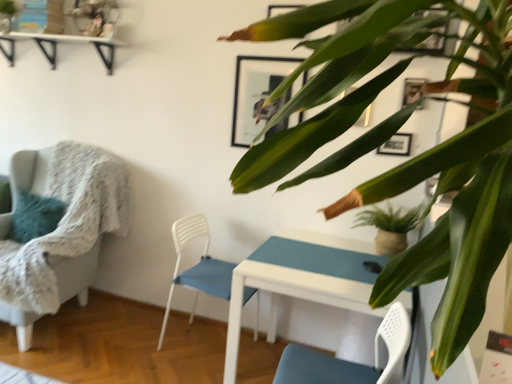
This screenshot has width=512, height=384. I want to click on blank area to the left of white plastic chair at center, marked as the second chair in a left-to-right arrangement, so click(129, 344).